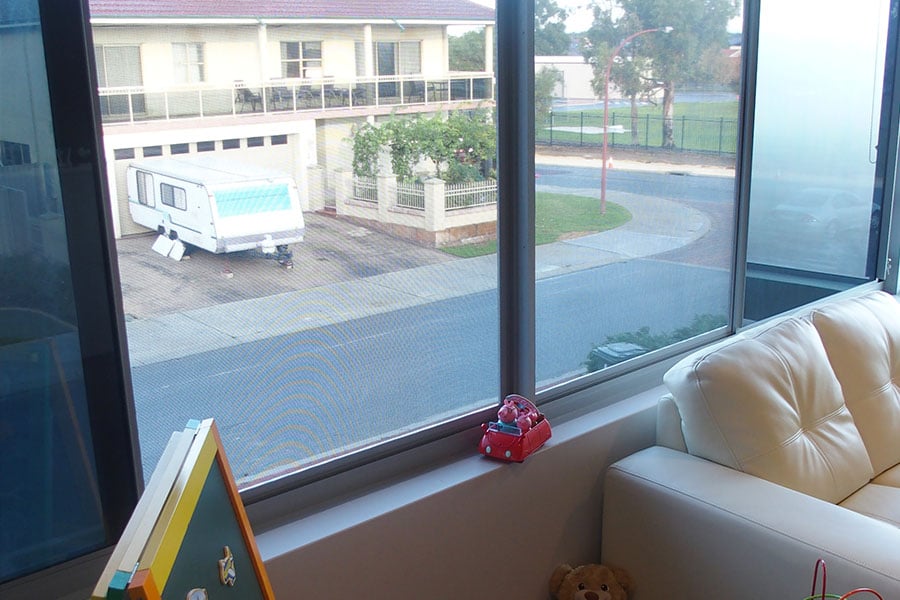
You are a GUI agent. You are given a task and a screenshot of the screen. Output one action in this format:
    pyautogui.click(x=<x>, y=<y>)
    Task: Click on the teddy bear
    This screenshot has height=600, width=900.
    Given the screenshot: What is the action you would take?
    click(574, 572)